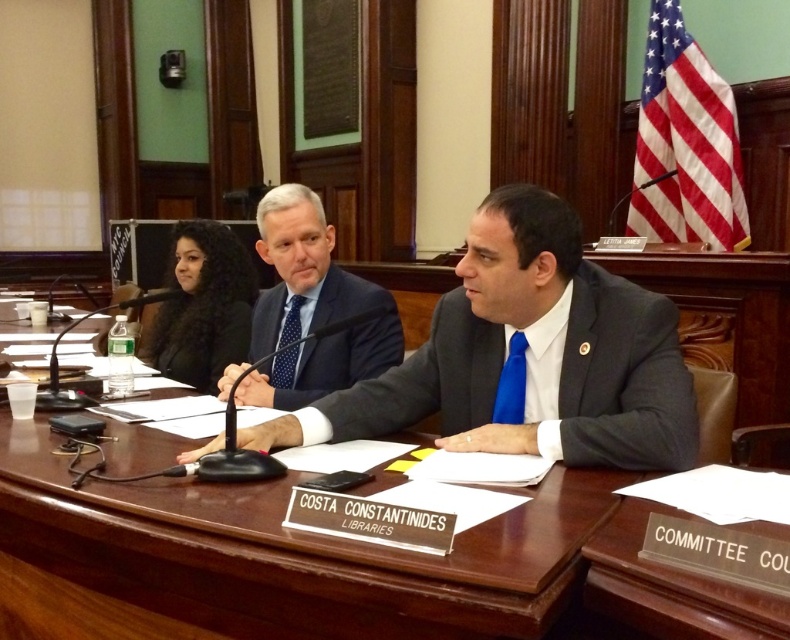
Question: Does brown wooden table at center have a larger size compared to blue silk tie at center?

Choices:
 (A) yes
 (B) no

Answer: (A)

Question: Which of these objects is positioned farthest from the wooden table at center?

Choices:
 (A) dark gray suit at center
 (B) brown wooden table at center
 (C) dark blue textured suit at center

Answer: (C)

Question: Can you confirm if brown wooden table at center is thinner than dark blue textured suit at center?

Choices:
 (A) yes
 (B) no

Answer: (B)

Question: Estimate the real-world distances between objects in this image. Which object is closer to the wooden table at center?

Choices:
 (A) brown wooden table at center
 (B) dark gray suit at center
 (C) blue silk tie at center

Answer: (A)

Question: Does dark gray suit at center appear over blue silk tie at center?

Choices:
 (A) yes
 (B) no

Answer: (B)

Question: Which object is positioned farthest from the polka dot silk tie at center?

Choices:
 (A) dark gray suit at center
 (B) brown wooden table at center

Answer: (B)